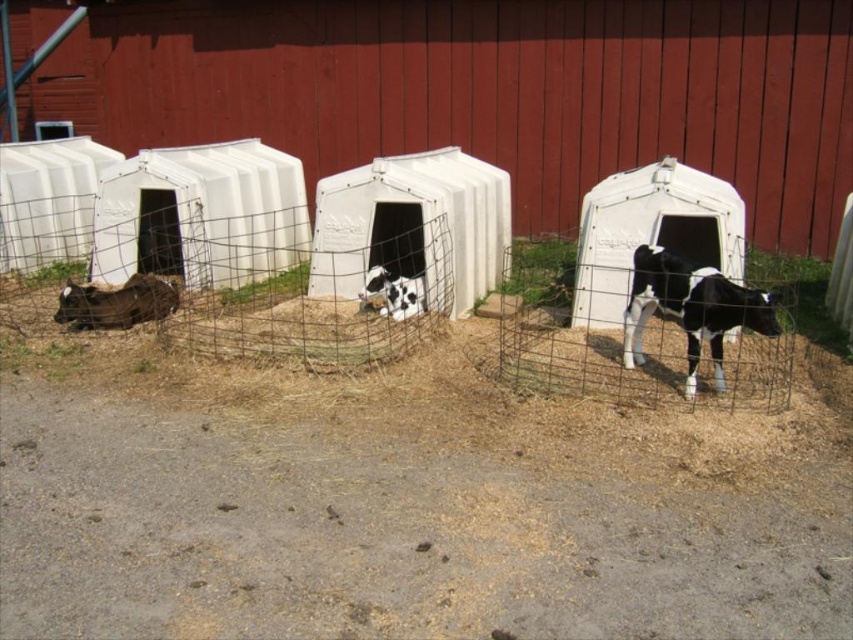
Locate an element on the screen. brown fuzzy calf at lower left is located at coordinates (117, 301).

Can you confirm if brown fuzzy calf at lower left is shorter than black and white spotted calf at center?

Indeed, brown fuzzy calf at lower left has a lesser height compared to black and white spotted calf at center.

Image resolution: width=853 pixels, height=640 pixels. What do you see at coordinates (117, 301) in the screenshot?
I see `brown fuzzy calf at lower left` at bounding box center [117, 301].

Locate an element on the screen. Image resolution: width=853 pixels, height=640 pixels. brown fuzzy calf at lower left is located at coordinates point(117,301).

Is point (735, 289) closer to viewer compared to point (161, 300)?

Yes, it is in front of point (161, 300).

Is the position of black and white spotted calf at right less distant than that of brown fuzzy calf at lower left?

Yes, it is in front of brown fuzzy calf at lower left.

Between point (691, 276) and point (59, 294), which one is positioned in front?

Point (691, 276)

Where is `black and white spotted calf at right`? Image resolution: width=853 pixels, height=640 pixels. black and white spotted calf at right is located at coordinates (691, 308).

Which is more to the left, black and white spotted calf at right or black and white spotted calf at center?

black and white spotted calf at center is more to the left.

Locate an element on the screen. The height and width of the screenshot is (640, 853). black and white spotted calf at right is located at coordinates (691, 308).

Who is more distant from viewer, (683, 260) or (380, 266)?

The point (380, 266) is behind.

Find the location of a particular element. black and white spotted calf at right is located at coordinates (691, 308).